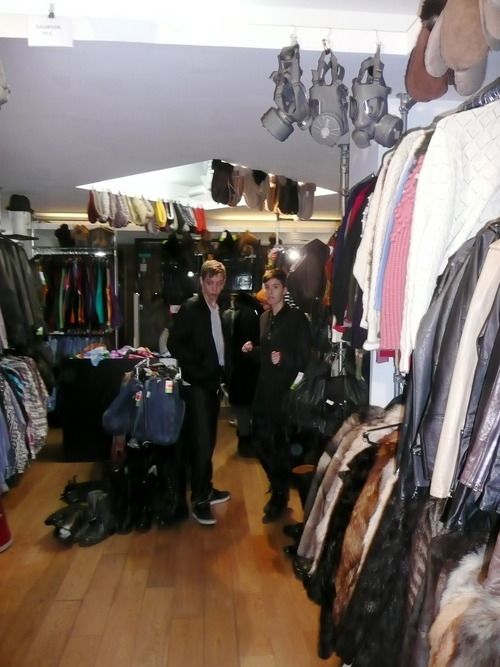
Find the location of `white ceiling`. white ceiling is located at coordinates (162, 111).